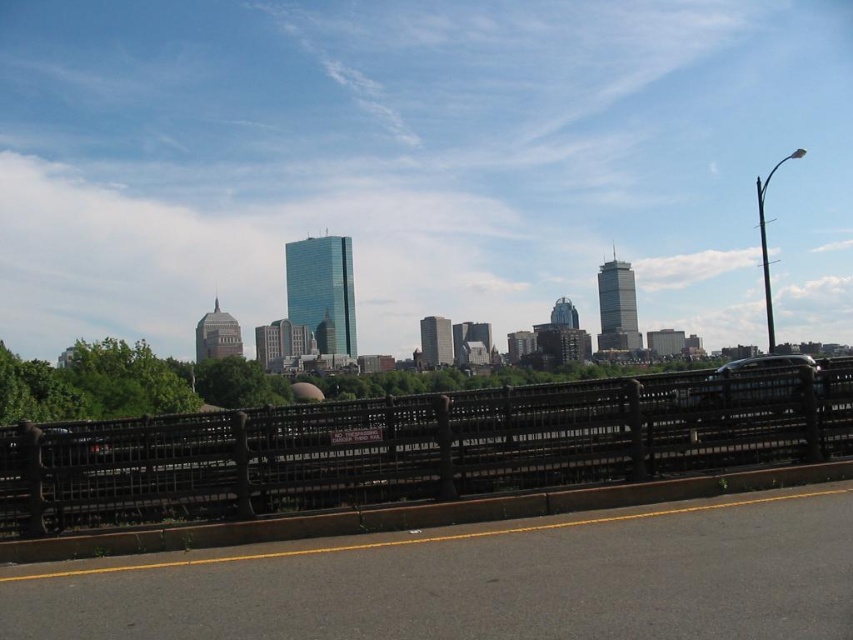
Who is higher up, black asphalt highway at lower center or black wrought iron fence at center?

black wrought iron fence at center is higher up.

How much distance is there between black asphalt highway at lower center and black wrought iron fence at center?

black asphalt highway at lower center and black wrought iron fence at center are 5.37 meters apart from each other.

What do you see at coordinates (480, 580) in the screenshot?
I see `black asphalt highway at lower center` at bounding box center [480, 580].

This screenshot has width=853, height=640. Find the location of `black asphalt highway at lower center`. black asphalt highway at lower center is located at coordinates (480, 580).

Does black asphalt highway at lower center have a lesser width compared to shiny silver car at right?

Correct, black asphalt highway at lower center's width is less than shiny silver car at right's.

Which is above, black asphalt highway at lower center or shiny silver car at right?

shiny silver car at right is higher up.

Which is in front, point (456, 573) or point (781, 356)?

Point (456, 573)

Find the location of a particular element. black asphalt highway at lower center is located at coordinates (480, 580).

This screenshot has height=640, width=853. What do you see at coordinates (403, 449) in the screenshot? I see `black wrought iron fence at center` at bounding box center [403, 449].

Between point (422, 490) and point (741, 365), which one is positioned in front?

Point (422, 490)

Who is more distant from viewer, (466, 413) or (766, 385)?

The point (766, 385) is more distant.

This screenshot has width=853, height=640. Find the location of `black wrought iron fence at center`. black wrought iron fence at center is located at coordinates (403, 449).